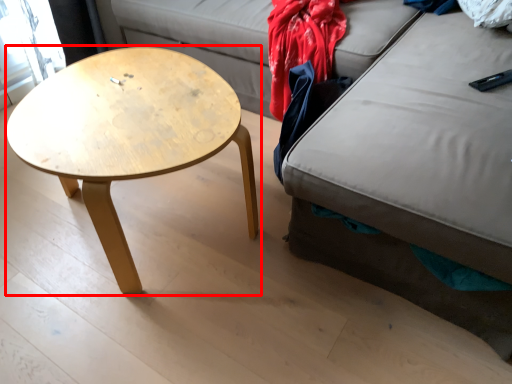
Question: In this image, where is coffee table (annotated by the red box) located relative to clothing?

Choices:
 (A) right
 (B) left

Answer: (B)